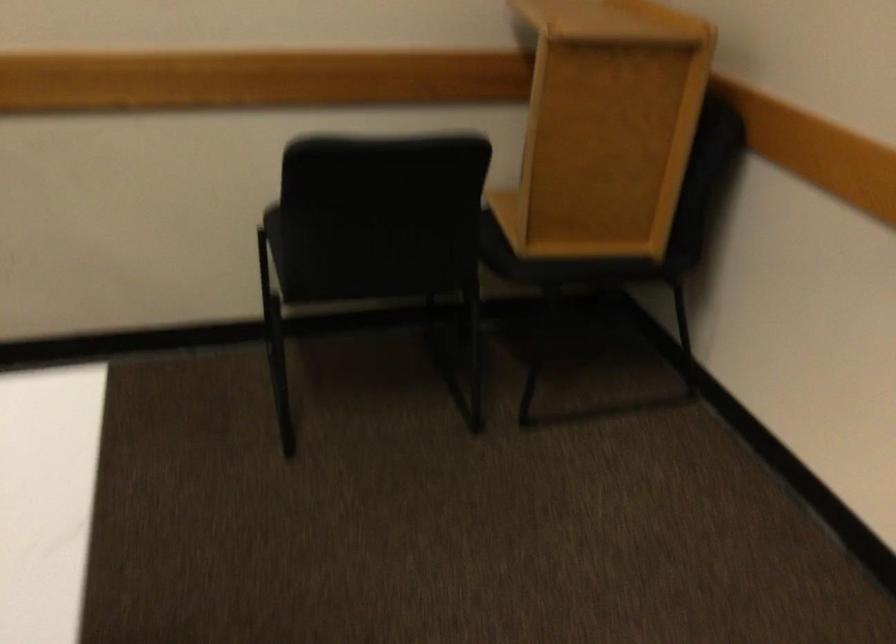
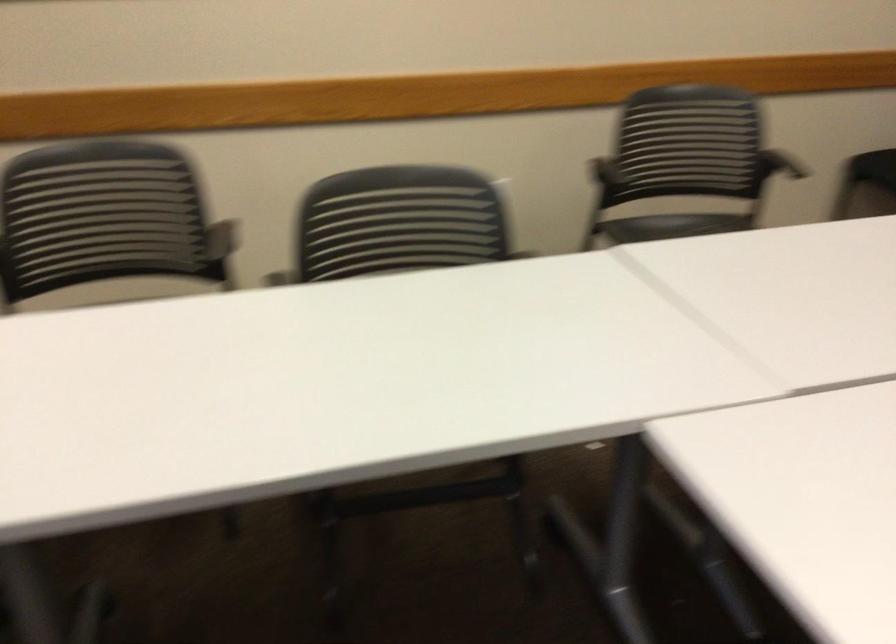
In the second image, find the point that corresponds to (140,223) in the first image.

(790, 166)